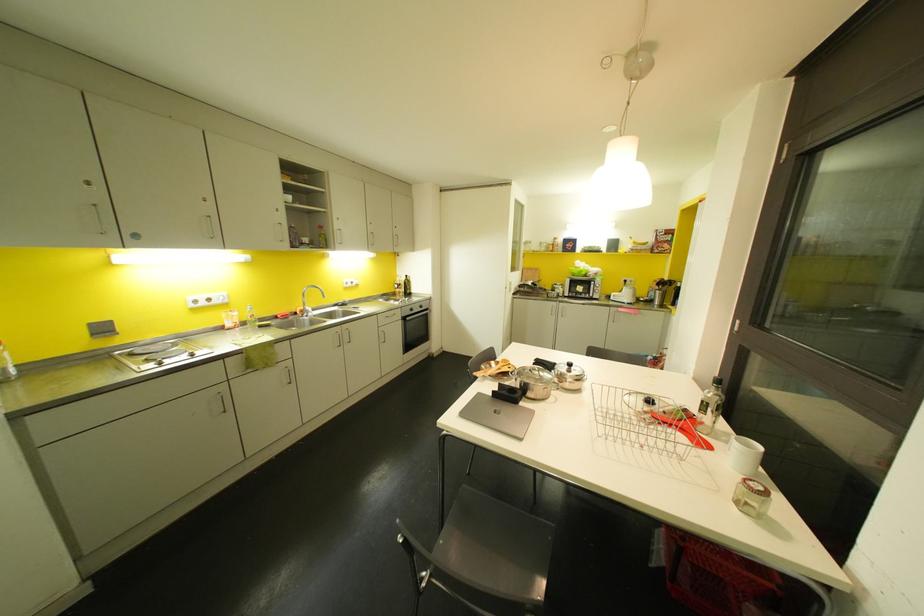
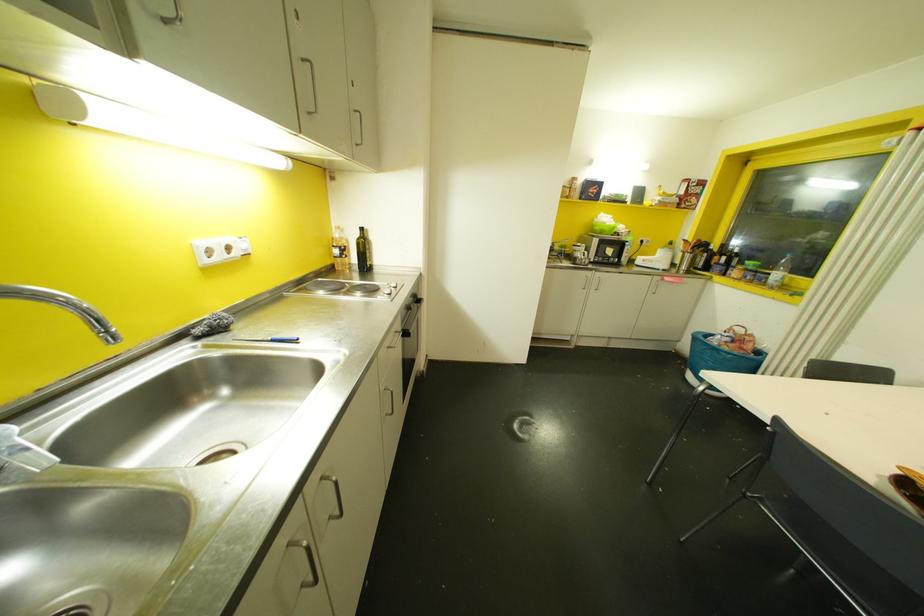
In the second image, find the point that corresponds to the point at 410,309 in the first image.

(407, 307)